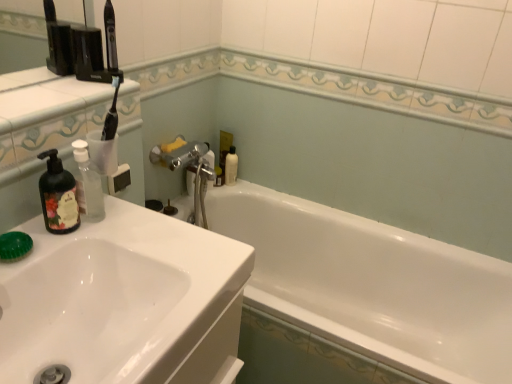
Question: Based on their positions, is white glossy bathtub at center located to the left or right of matte black soap dispenser at left?

Choices:
 (A) left
 (B) right

Answer: (B)

Question: Is white glossy bathtub at center spatially inside matte black soap dispenser at left, or outside of it?

Choices:
 (A) inside
 (B) outside

Answer: (B)

Question: Which is nearer to the clear plastic bottle at left?

Choices:
 (A) matte black soap dispenser at left
 (B) white glossy sink at left
 (C) translucent plastic bottle at upper center
 (D) white glossy bathtub at center

Answer: (A)

Question: Estimate the real-world distances between objects in this image. Which object is closer to the white glossy bathtub at center?

Choices:
 (A) clear plastic bottle at left
 (B) white glossy sink at left
 (C) matte black soap dispenser at left
 (D) translucent plastic bottle at upper center

Answer: (D)